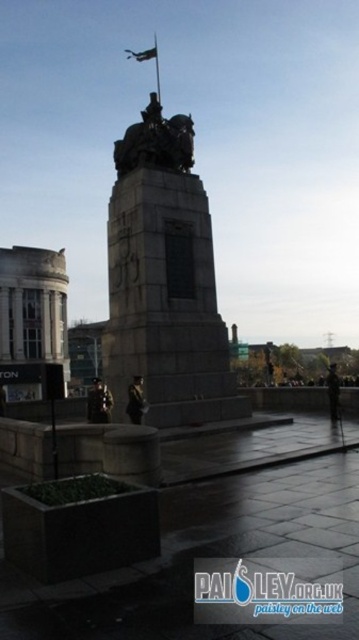
Question: Which of the following is the farthest from the observer?

Choices:
 (A) dark brown uniform at center
 (B) dark uniformed figure at center

Answer: (B)

Question: Among these points, which one is nearest to the camera?

Choices:
 (A) (333, 408)
 (B) (136, 406)
 (C) (146, 54)
 (D) (199, 384)

Answer: (B)

Question: Which of these objects is positioned farthest from the stone statue at center?

Choices:
 (A) metallic flag at upper center
 (B) dark brown uniform at center

Answer: (A)

Question: Is metallic statue at center behind dark uniformed figure at center?

Choices:
 (A) no
 (B) yes

Answer: (A)

Question: Can you confirm if stone statue at center is bigger than metallic flag at upper center?

Choices:
 (A) no
 (B) yes

Answer: (A)

Question: From the image, what is the correct spatial relationship of dark uniformed figure at center in relation to metallic flag at upper center?

Choices:
 (A) left
 (B) right

Answer: (B)